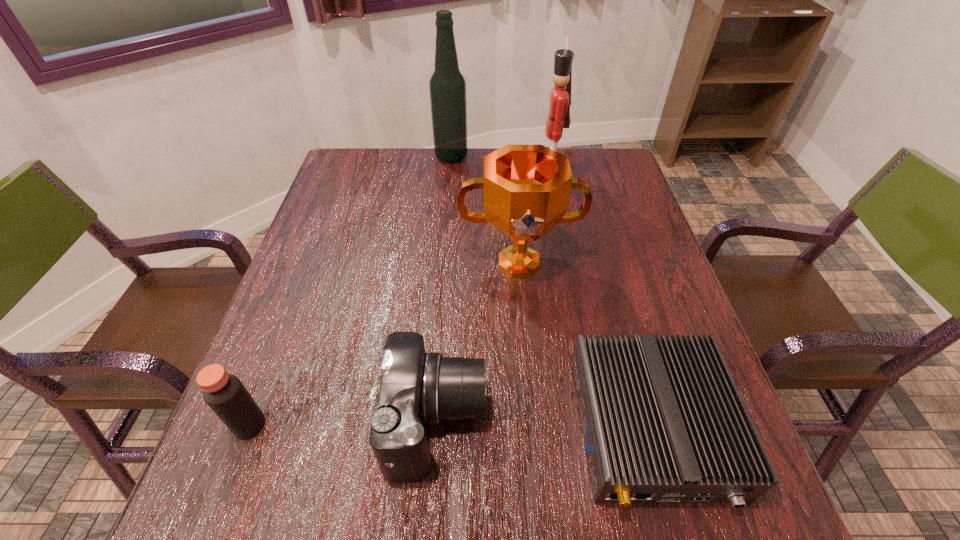
In order to click on empty space between the alcohol and the vinegar in this screenshot , I will do `click(350, 291)`.

Where is `free space that is in between the router and the second farthest object`? free space that is in between the router and the second farthest object is located at coordinates (601, 303).

At what (x,y) coordinates should I click in order to perform the action: click on free spot between the vinegar and the camera. Please return your answer as a coordinate pair (x, y). This screenshot has width=960, height=540. Looking at the image, I should click on (343, 423).

The width and height of the screenshot is (960, 540). I want to click on object that is the second closest to the fifth nearest object, so click(526, 188).

Identify which object is located as the third nearest to the award. Please provide its 2D coordinates. Your answer should be formatted as a tuple, i.e. [(x, y)], where the tuple contains the x and y coordinates of a point satisfying the conditions above.

[(558, 117)]